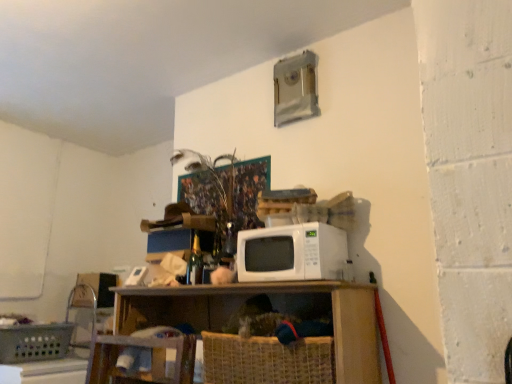
Question: Visually, is white matte microwave at center positioned to the left or to the right of woven straw basket at lower center, marked as the first basket in a right-to-left arrangement?

Choices:
 (A) right
 (B) left

Answer: (A)

Question: Is white matte microwave at center taller or shorter than woven straw basket at lower center, marked as the first basket in a right-to-left arrangement?

Choices:
 (A) tall
 (B) short

Answer: (B)

Question: Which is farther from the plastic woven basket at lower left, which is the second basket in right-to-left order?

Choices:
 (A) wooden shelf at center
 (B) woven straw basket at lower center, the second basket positioned from the left
 (C) white matte microwave at center
 (D) wooden swivel chair at lower left

Answer: (C)

Question: Which object is positioned closest to the plastic woven basket at lower left, which is the second basket in right-to-left order?

Choices:
 (A) woven straw basket at lower center, the second basket positioned from the left
 (B) wooden swivel chair at lower left
 (C) wooden shelf at center
 (D) white matte microwave at center

Answer: (B)